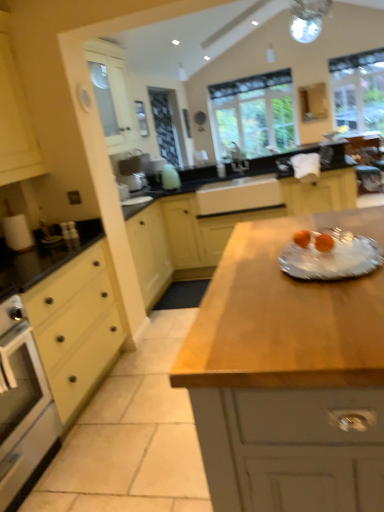
At what (x,y) coordinates should I click in order to perform the action: click on vacant point to the left of clear glass plate at center. Please return your answer as a coordinate pair (x, y). This screenshot has width=384, height=512. Looking at the image, I should click on (238, 279).